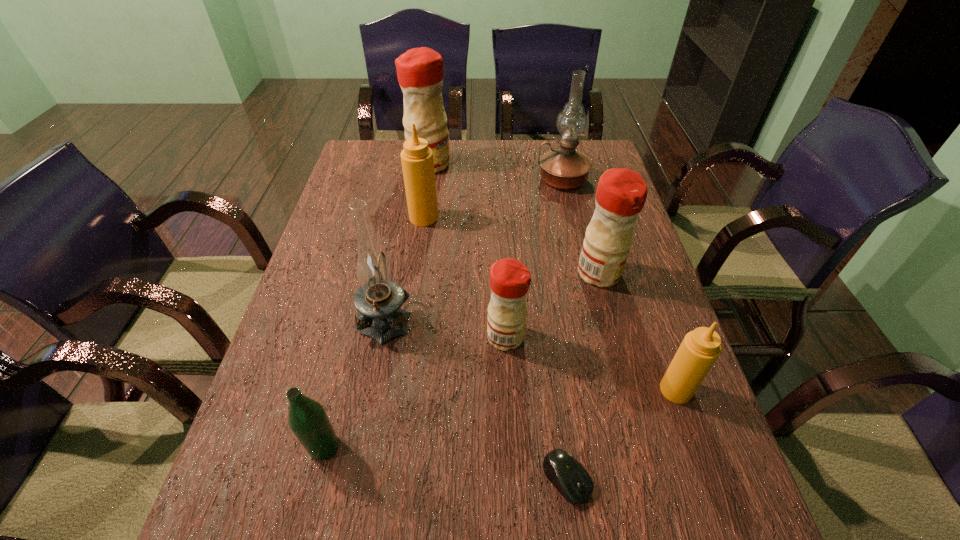
The height and width of the screenshot is (540, 960). Find the location of `the smallest red condiment`. the smallest red condiment is located at coordinates (510, 279).

The width and height of the screenshot is (960, 540). What are the coordinates of `the fifth object from right to left` in the screenshot? It's located at (510, 279).

At what (x,y) coordinates should I click in order to perform the action: click on bottle. Please return your answer as a coordinate pair (x, y). Image resolution: width=960 pixels, height=540 pixels. Looking at the image, I should click on (307, 418).

At what (x,y) coordinates should I click in order to perform the action: click on the shortest object. Please return your answer as a coordinate pair (x, y). This screenshot has height=540, width=960. Looking at the image, I should click on (568, 476).

The image size is (960, 540). What are the coordinates of `mouse` in the screenshot? It's located at (568, 476).

You are a GUI agent. You are given a task and a screenshot of the screen. Output one action in this format:
    pyautogui.click(x=<x>, y=<y>)
    Task: Click on the free space located on the right of the biggest red condiment
    The height and width of the screenshot is (540, 960).
    Given the screenshot: What is the action you would take?
    pyautogui.click(x=499, y=164)

The height and width of the screenshot is (540, 960). I want to click on vacant space located 0.110m on the left of the farther oil lamp, so click(x=503, y=179).

Locate an element on the screen. This screenshot has height=540, width=960. free space located 0.070m on the left of the nearer oil lamp is located at coordinates (334, 318).

Find the location of a particular element. Image resolution: width=960 pixels, height=540 pixels. vacant area situated 0.180m on the right of the fourth nearest condiment is located at coordinates (498, 218).

Identify the location of free space located 0.280m on the left of the rightmost red condiment. The image size is (960, 540). (470, 273).